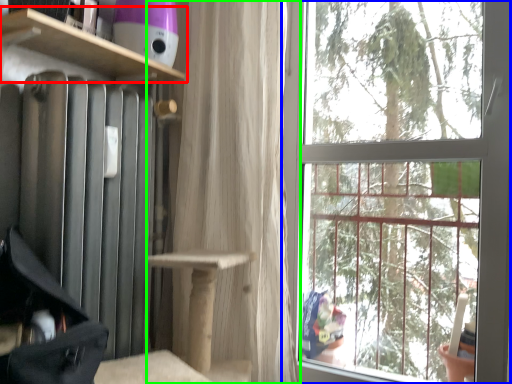
Question: Which object is the closest to the shelf (highlighted by a red box)? Choose among these: window (highlighted by a blue box) or curtain (highlighted by a green box).

Choices:
 (A) window
 (B) curtain

Answer: (B)